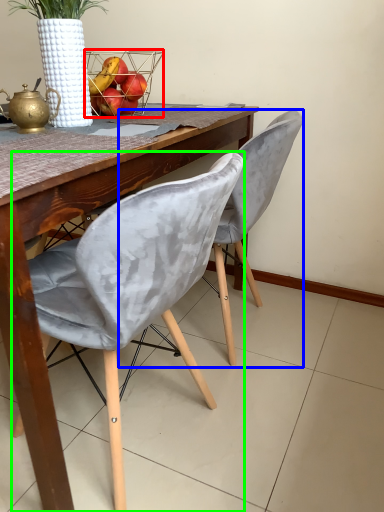
Question: Estimate the real-world distances between objects in this image. Which object is closer to basket (highlighted by a red box), chair (highlighted by a blue box) or chair (highlighted by a green box)?

Choices:
 (A) chair
 (B) chair

Answer: (A)